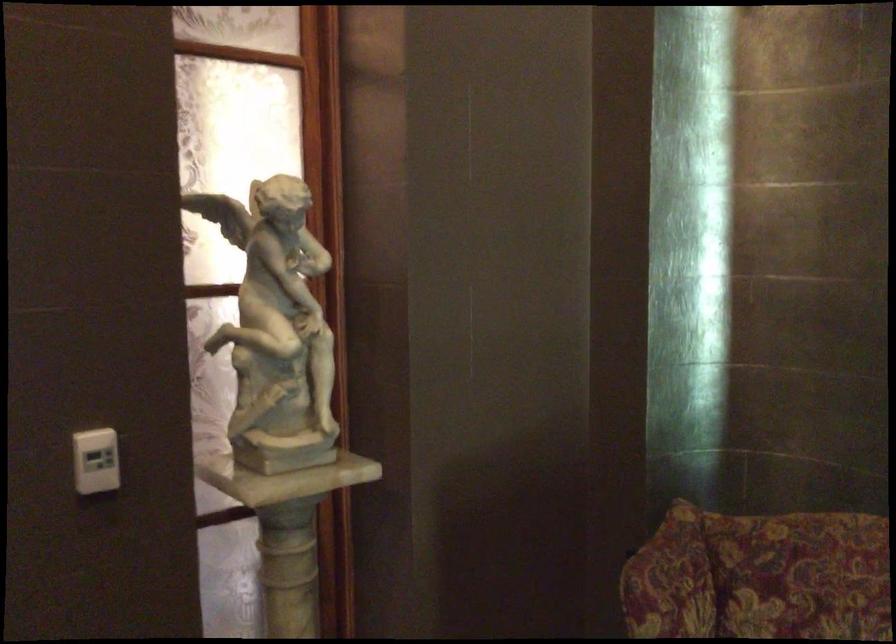
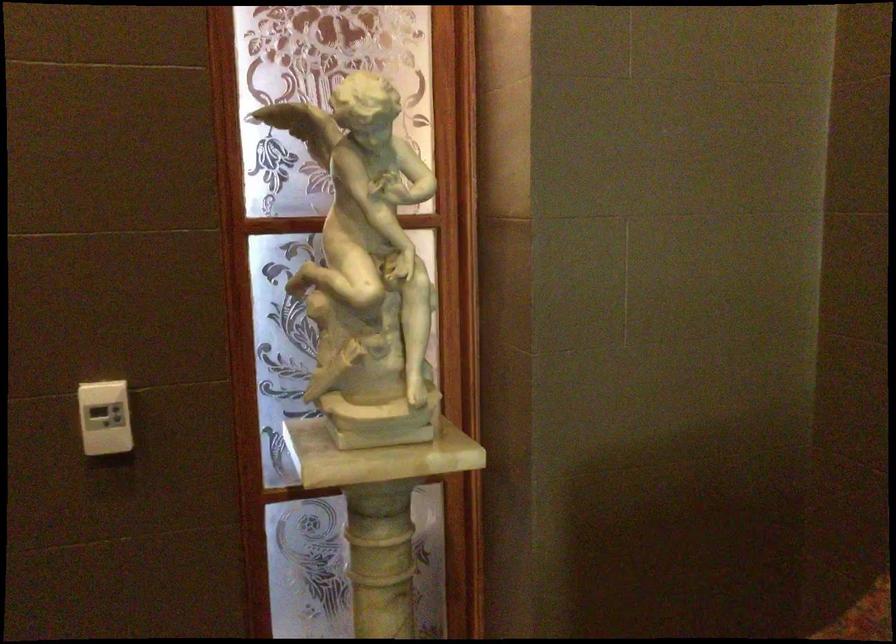
Question: The camera is either moving clockwise (left) or counter-clockwise (right) around the object. The first image is from the beginning of the video and the second image is from the end. Is the camera moving left or right when shooting the video?

Choices:
 (A) Left
 (B) Right

Answer: (B)